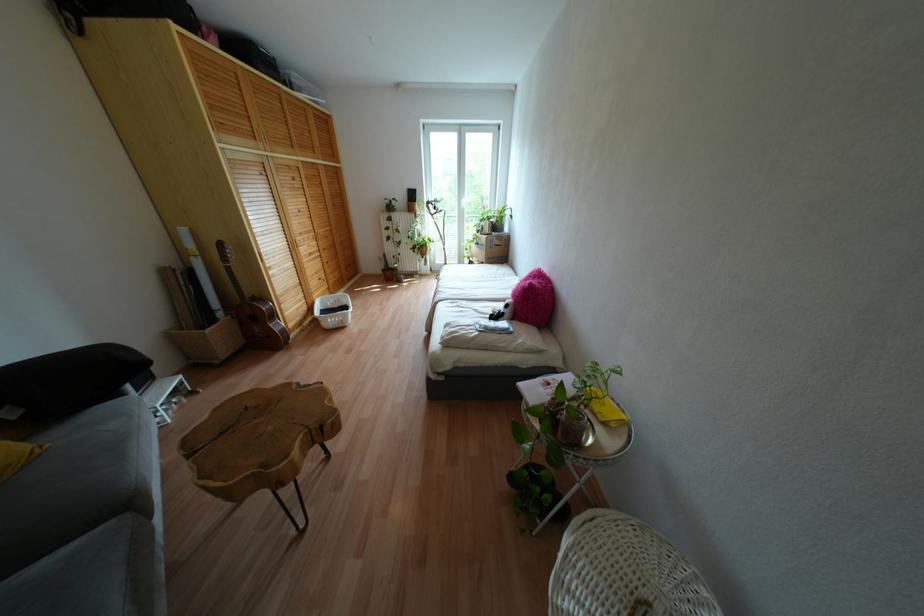
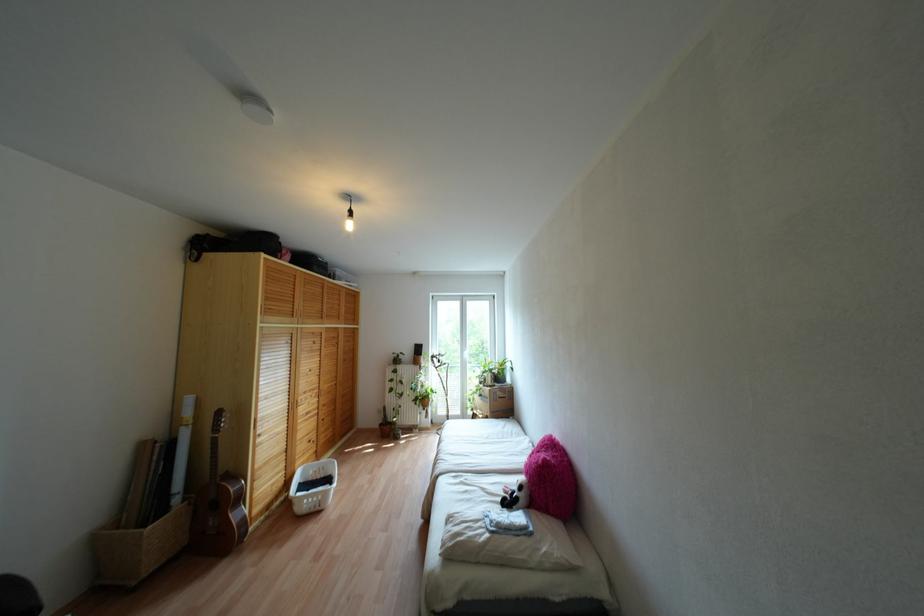
Find the pixel in the second image that matches point (335, 175) in the first image.

(351, 334)